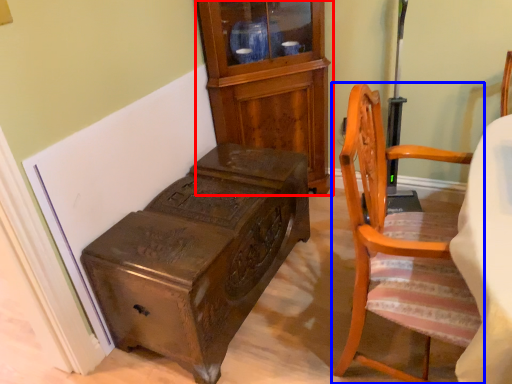
Question: Which of the following is the farthest to the observer, cabinetry (highlighted by a red box) or chair (highlighted by a blue box)?

Choices:
 (A) cabinetry
 (B) chair

Answer: (A)